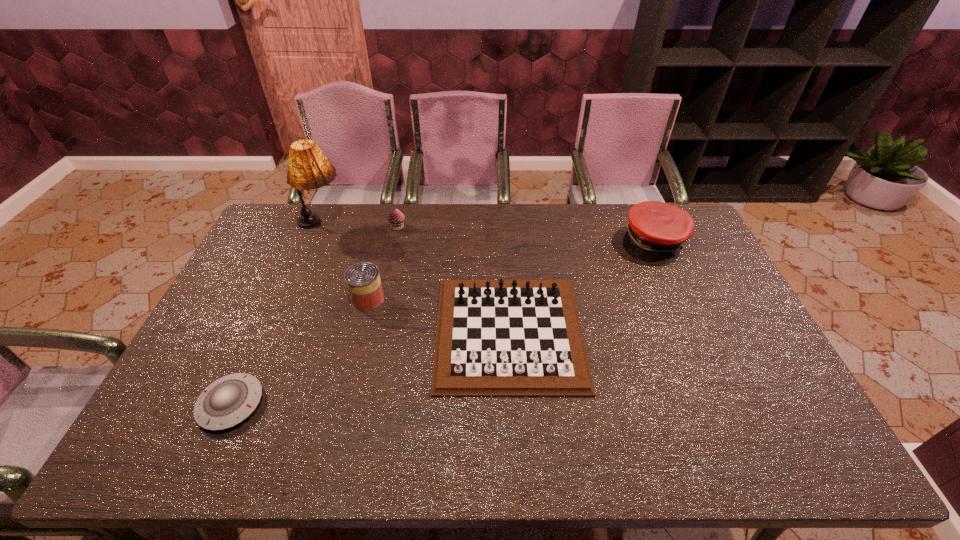
This screenshot has height=540, width=960. I want to click on vacant space located on the right of the second object from right to left, so click(719, 332).

Identify the location of free space located 0.340m on the back of the saucer. (284, 287).

Image resolution: width=960 pixels, height=540 pixels. Find the location of `lampshade at the far edge`. lampshade at the far edge is located at coordinates (308, 168).

The width and height of the screenshot is (960, 540). I want to click on cap that is positioned at the far edge, so (656, 229).

The height and width of the screenshot is (540, 960). I want to click on cupcake present at the far edge, so click(396, 218).

I want to click on object that is positioned at the near edge, so click(229, 400).

At what (x,y) coordinates should I click in order to perform the action: click on lampshade present at the left edge. Please return your answer as a coordinate pair (x, y). Looking at the image, I should click on (308, 168).

Identify the location of saucer present at the left edge. (229, 400).

This screenshot has height=540, width=960. In order to click on object located at the right edge in this screenshot , I will do `click(656, 229)`.

Where is `object positioned at the far left corner`? object positioned at the far left corner is located at coordinates (308, 168).